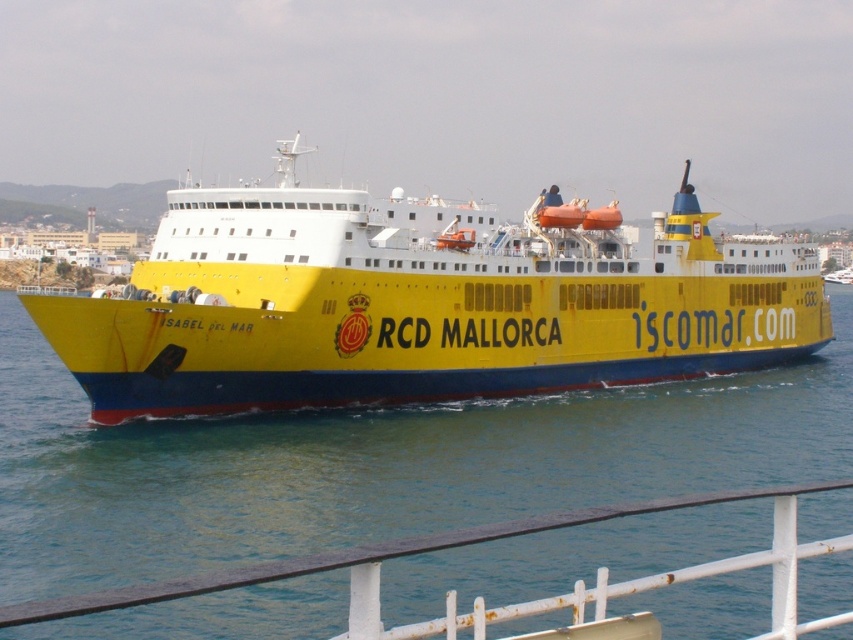
Question: Is yellow matte ship at center above blue water at center?

Choices:
 (A) yes
 (B) no

Answer: (A)

Question: Is yellow matte ship at center bigger than blue water at center?

Choices:
 (A) yes
 (B) no

Answer: (A)

Question: Based on their relative distances, which object is farther from the yellow matte ship at center?

Choices:
 (A) white metal railing at lower center
 (B) blue water at center

Answer: (A)

Question: Can you confirm if yellow matte ship at center is bigger than blue water at center?

Choices:
 (A) yes
 (B) no

Answer: (A)

Question: Among these points, which one is farthest from the camera?

Choices:
 (A) (267, 579)
 (B) (86, 435)
 (C) (225, 364)

Answer: (B)

Question: Among these objects, which one is nearest to the camera?

Choices:
 (A) yellow matte ship at center
 (B) white metal railing at lower center
 (C) blue water at center

Answer: (B)